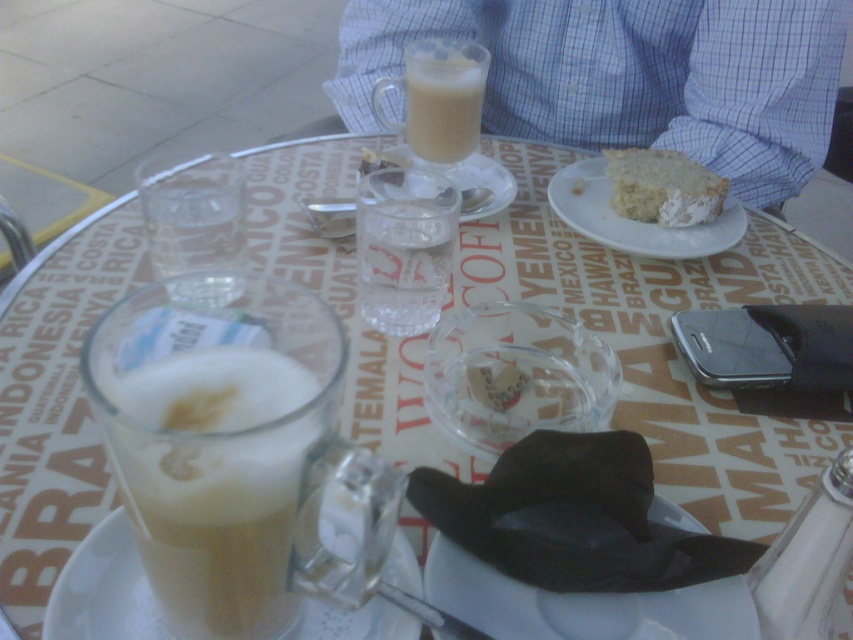
Does foamy white latte at center have a larger size compared to white crumbly cake at upper right?

Yes.

Is foamy white latte at center in front of white crumbly cake at upper right?

Yes, it is.

Does point (293, 595) come farther from viewer compared to point (618, 208)?

No, (293, 595) is in front of (618, 208).

The width and height of the screenshot is (853, 640). Find the location of `foamy white latte at center`. foamy white latte at center is located at coordinates click(x=225, y=445).

Does smooth frothy latte at upper center have a greater width compared to white crumbly cake at upper right?

No.

This screenshot has height=640, width=853. Find the location of `smooth frothy latte at upper center`. smooth frothy latte at upper center is located at coordinates point(444,99).

Is clear glass water at center thinner than white crumbly cake at upper right?

Indeed, clear glass water at center has a lesser width compared to white crumbly cake at upper right.

Is clear glass water at center above white crumbly cake at upper right?

No, clear glass water at center is not above white crumbly cake at upper right.

Is point (399, 168) positioned after point (664, 212)?

That is False.

At what (x,y) coordinates should I click in order to perform the action: click on clear glass water at center. Please return your answer as a coordinate pair (x, y). The width and height of the screenshot is (853, 640). Looking at the image, I should click on (404, 248).